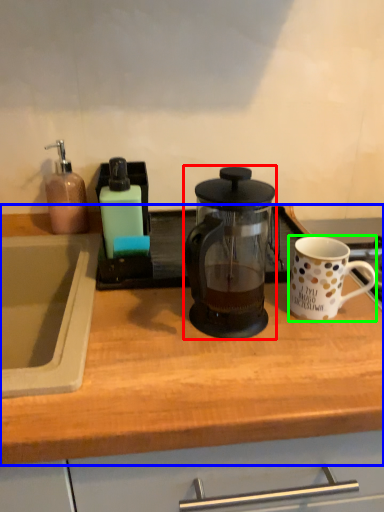
Question: Which object is positioned farthest from kettle (highlighted by a red box)? Select from countertop (highlighted by a blue box) and coffee cup (highlighted by a green box).

Choices:
 (A) countertop
 (B) coffee cup

Answer: (A)